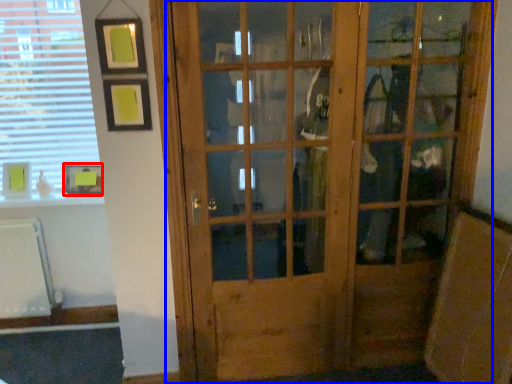
Question: Which object appears farthest to the camera in this image, picture frame (highlighted by a red box) or door (highlighted by a blue box)?

Choices:
 (A) picture frame
 (B) door

Answer: (A)